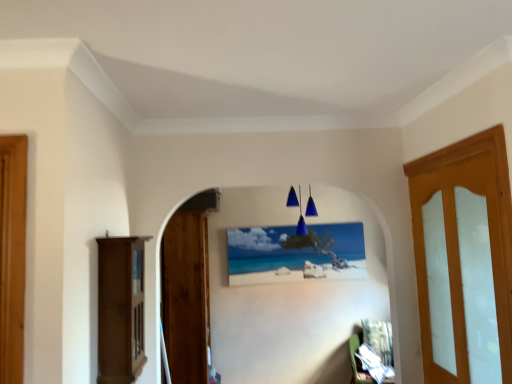
Question: Is the depth of blue glass pendant lights at center less than that of matte canvas painting at center?

Choices:
 (A) no
 (B) yes

Answer: (B)

Question: Is blue glass pendant lights at center outside matte canvas painting at center?

Choices:
 (A) no
 (B) yes

Answer: (B)

Question: From a real-world perspective, is blue glass pendant lights at center on matte canvas painting at center?

Choices:
 (A) no
 (B) yes

Answer: (B)

Question: Is blue glass pendant lights at center surrounding matte canvas painting at center?

Choices:
 (A) yes
 (B) no

Answer: (B)

Question: Is blue glass pendant lights at center thinner than matte canvas painting at center?

Choices:
 (A) yes
 (B) no

Answer: (B)

Question: Considering the relative positions of blue glass pendant lights at center and matte canvas painting at center in the image provided, is blue glass pendant lights at center behind matte canvas painting at center?

Choices:
 (A) no
 (B) yes

Answer: (A)

Question: Is wooden door at left, the 1th door viewed from the left, wider than light brown wooden door at right, arranged as the 2th door when viewed from the left?

Choices:
 (A) no
 (B) yes

Answer: (B)

Question: Considering the relative sizes of wooden door at left, the second door positioned from the right, and light brown wooden door at right, which appears as the 1th door when viewed from the right, in the image provided, is wooden door at left, the second door positioned from the right, thinner than light brown wooden door at right, which appears as the 1th door when viewed from the right,?

Choices:
 (A) yes
 (B) no

Answer: (B)

Question: Considering the relative sizes of wooden door at left, the 1th door viewed from the left, and light brown wooden door at right, arranged as the second door when viewed from the back, in the image provided, is wooden door at left, the 1th door viewed from the left, taller than light brown wooden door at right, arranged as the second door when viewed from the back,?

Choices:
 (A) no
 (B) yes

Answer: (B)

Question: Does wooden door at left, which is the 1th door in back-to-front order, lie behind light brown wooden door at right, arranged as the 2th door when viewed from the left?

Choices:
 (A) yes
 (B) no

Answer: (A)

Question: From a real-world perspective, is wooden door at left, the second door positioned from the right, positioned over light brown wooden door at right, arranged as the second door when viewed from the back, based on gravity?

Choices:
 (A) yes
 (B) no

Answer: (B)

Question: Would you say wooden door at left, the second door positioned from the right, is a long distance from light brown wooden door at right, arranged as the 2th door when viewed from the left?

Choices:
 (A) no
 (B) yes

Answer: (B)

Question: From a real-world perspective, is denim fabric chair at lower right, which ranks as the 1th furniture in right-to-left order, over matte canvas painting at center?

Choices:
 (A) no
 (B) yes

Answer: (A)